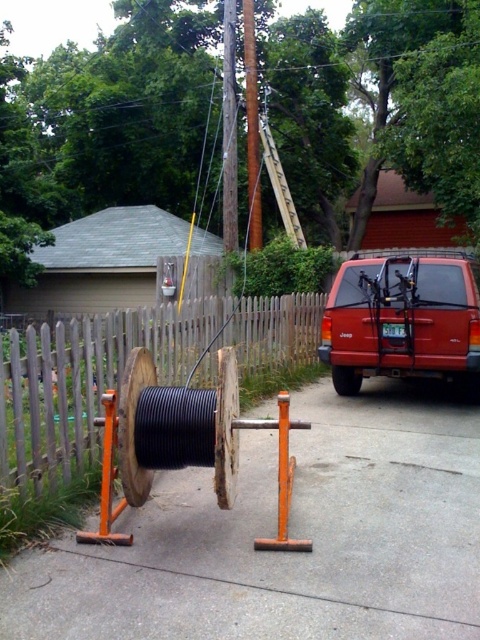
Is wooden picket fence at center further to the viewer compared to matte red suv at center right?

That is False.

Locate an element on the screen. This screenshot has height=640, width=480. wooden picket fence at center is located at coordinates (x=85, y=380).

Is point (17, 362) less distant than point (336, 342)?

Yes, point (17, 362) is closer to viewer.

Where is `wooden picket fence at center`? This screenshot has height=640, width=480. wooden picket fence at center is located at coordinates (85, 380).

Is black rubber cable at center closer to the viewer compared to matte red suv at center right?

Yes, it is in front of matte red suv at center right.

Consider the image. Is black rubber cable at center positioned at the back of matte red suv at center right?

No.

Where is `black rubber cable at center`? This screenshot has height=640, width=480. black rubber cable at center is located at coordinates (289, 532).

What are the coordinates of `black rubber cable at center` in the screenshot? It's located at click(x=289, y=532).

The width and height of the screenshot is (480, 640). What do you see at coordinates (289, 532) in the screenshot?
I see `black rubber cable at center` at bounding box center [289, 532].

Measure the distance between point (368, 385) and camera.

Point (368, 385) is 34.34 feet away from camera.

Between point (392, 625) and point (97, 314), which one is positioned behind?

The point (97, 314) is more distant.

I want to click on black rubber cable at center, so click(289, 532).